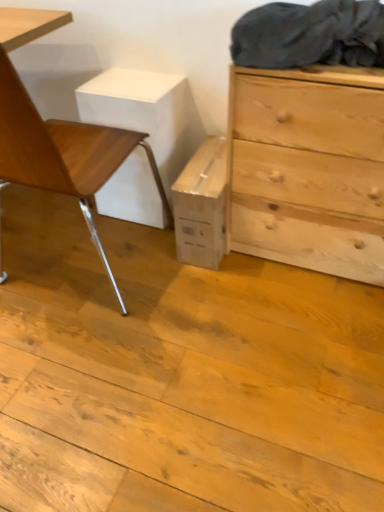
Find the location of a particular element. blank area beneath wooden chair at left (from a real-world perspective) is located at coordinates (75, 262).